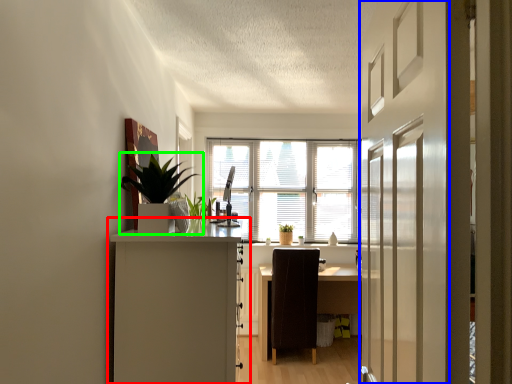
Question: Based on their relative distances, which object is nearer to cabinetry (highlighted by a red box)? Choose from screen door (highlighted by a blue box) and houseplant (highlighted by a green box).

Choices:
 (A) screen door
 (B) houseplant

Answer: (B)